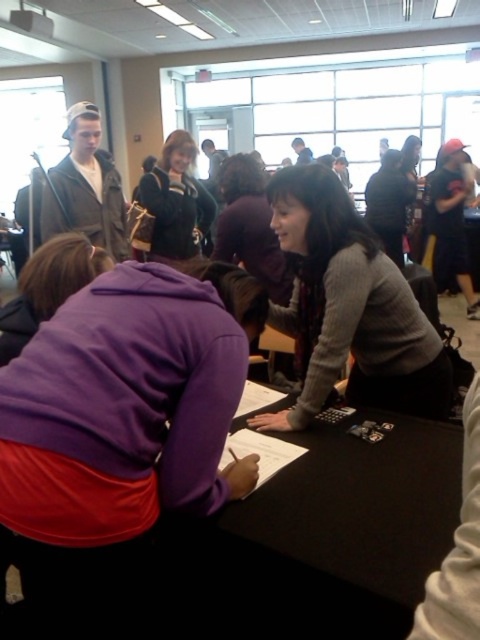
Question: Is black matte table at center positioned in front of gray sweater at center?

Choices:
 (A) yes
 (B) no

Answer: (A)

Question: Which object is the farthest from the dark gray sweater at center?

Choices:
 (A) gray sweater at center
 (B) matte black hoodie at center
 (C) black matte table at center

Answer: (C)

Question: Which object is farther from the camera taking this photo?

Choices:
 (A) dark gray sweater at center
 (B) matte black hoodie at center

Answer: (B)

Question: Among these objects, which one is nearest to the camera?

Choices:
 (A) black matte table at center
 (B) matte black hoodie at center
 (C) dark gray sweater at center
 (D) gray sweater at center

Answer: (A)

Question: Does dark gray sweater at center have a greater width compared to matte black hoodie at center?

Choices:
 (A) no
 (B) yes

Answer: (A)

Question: Can you confirm if black matte table at center is bigger than matte black hoodie at center?

Choices:
 (A) yes
 (B) no

Answer: (B)